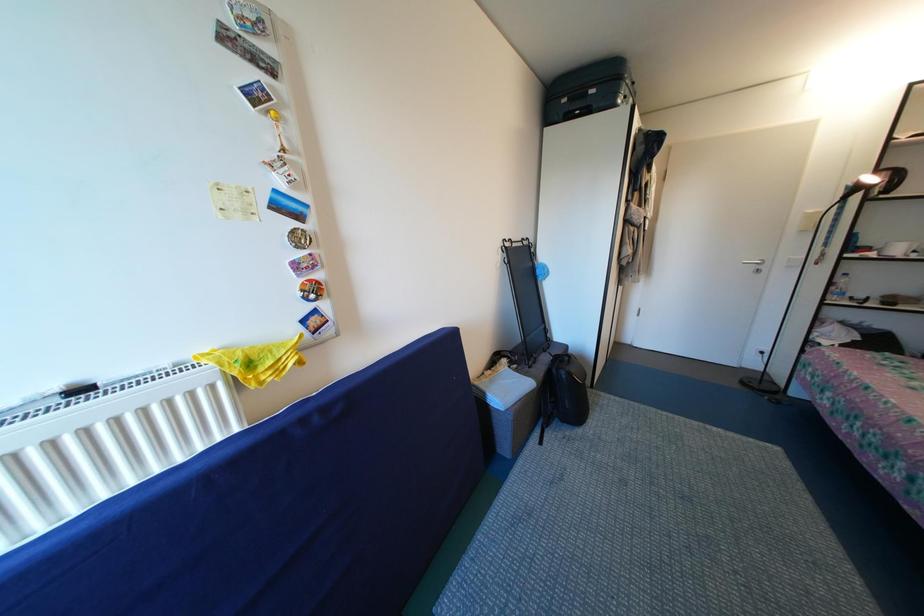
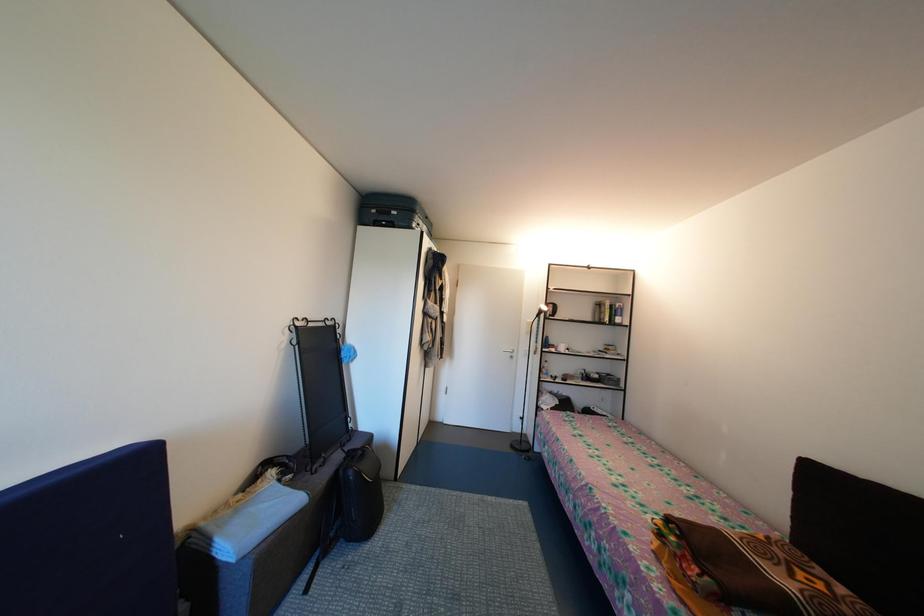
The first image is from the beginning of the video and the second image is from the end. How did the camera likely rotate when shooting the video?

The rotation direction of the camera is right-up.